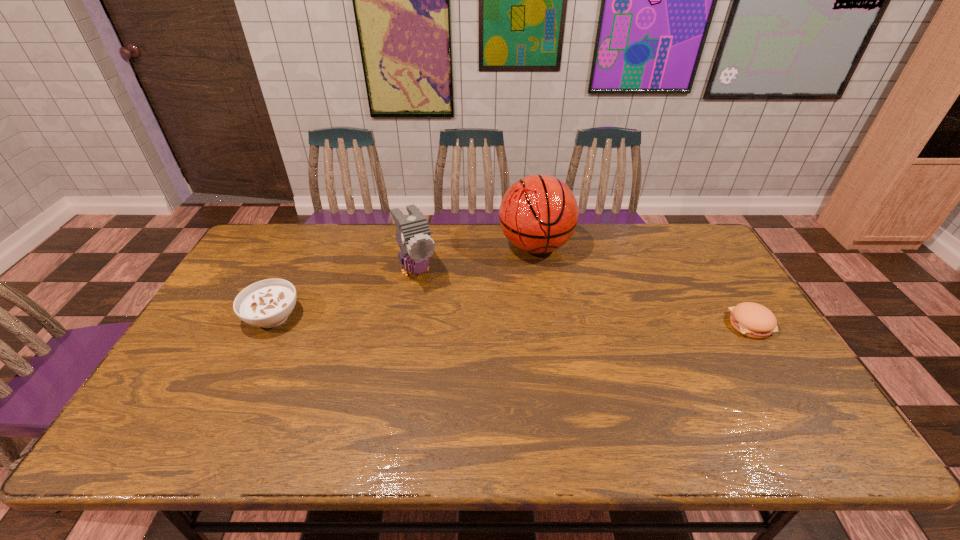
The image size is (960, 540). I want to click on vacant area between the rightmost object and the third object from left to right, so click(643, 285).

Locate an element on the screen. The height and width of the screenshot is (540, 960). vacant space that is in between the second shortest object and the patty is located at coordinates (512, 321).

The height and width of the screenshot is (540, 960). What are the coordinates of `empty location between the soup bowl and the third shortest object` in the screenshot? It's located at (345, 293).

Identify the location of free space that is in between the bird and the second object from right to left. The height and width of the screenshot is (540, 960). (476, 258).

Locate an element on the screen. This screenshot has height=540, width=960. unoccupied position between the basketball and the bird is located at coordinates (476, 258).

Locate an element on the screen. This screenshot has height=540, width=960. vacant point located between the leftmost object and the second tallest object is located at coordinates (345, 293).

Identify which object is located as the second nearest to the third tallest object. Please provide its 2D coordinates. Your answer should be formatted as a tuple, i.e. [(x, y)], where the tuple contains the x and y coordinates of a point satisfying the conditions above.

[(538, 214)]

The height and width of the screenshot is (540, 960). I want to click on object that stands as the second closest to the shortest object, so click(x=413, y=235).

Where is `free space that satisfies the following two spatial constraints: 1. on the back side of the soup bowl; 2. on the left side of the second tallest object`? free space that satisfies the following two spatial constraints: 1. on the back side of the soup bowl; 2. on the left side of the second tallest object is located at coordinates (296, 269).

This screenshot has width=960, height=540. In order to click on vacant space that satisfies the following two spatial constraints: 1. on the back side of the basketball; 2. on the left side of the second tallest object in this screenshot , I will do pyautogui.click(x=420, y=246).